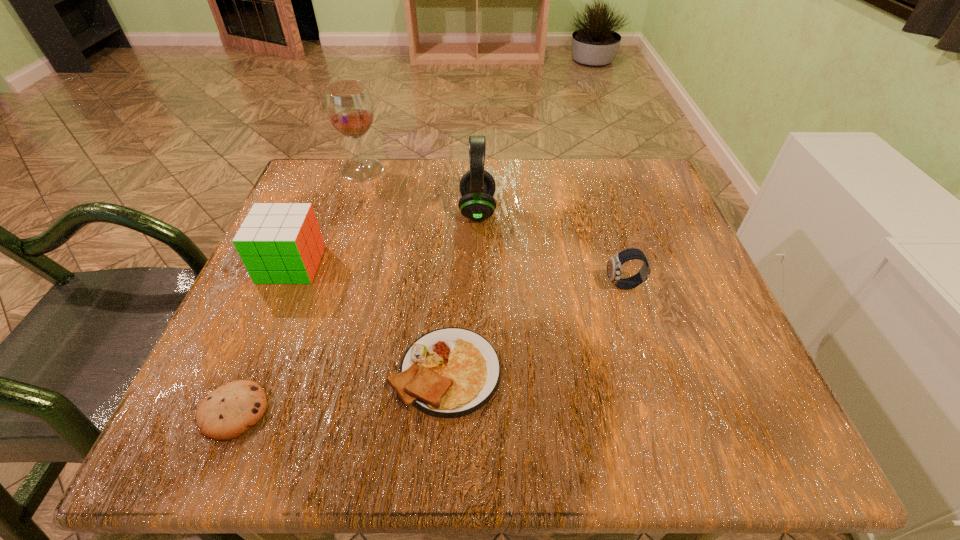
Where is `vacant area between the cube and the fourth tallest object`? This screenshot has width=960, height=540. vacant area between the cube and the fourth tallest object is located at coordinates (458, 275).

Where is `free space between the fourth shortest object and the omelet`? This screenshot has height=540, width=960. free space between the fourth shortest object and the omelet is located at coordinates (369, 318).

Where is `free spot between the second farthest object and the watch`? The height and width of the screenshot is (540, 960). free spot between the second farthest object and the watch is located at coordinates (551, 248).

This screenshot has width=960, height=540. What are the coordinates of `free space between the omelet and the tallest object` in the screenshot? It's located at point(404,271).

Identify which object is the second closest to the omelet. Please provide its 2D coordinates. Your answer should be formatted as a tuple, i.e. [(x, y)], where the tuple contains the x and y coordinates of a point satisfying the conditions above.

[(279, 243)]

Identify which object is the closest to the third shortest object. Please provide its 2D coordinates. Your answer should be formatted as a tuple, i.e. [(x, y)], where the tuple contains the x and y coordinates of a point satisfying the conditions above.

[(451, 372)]